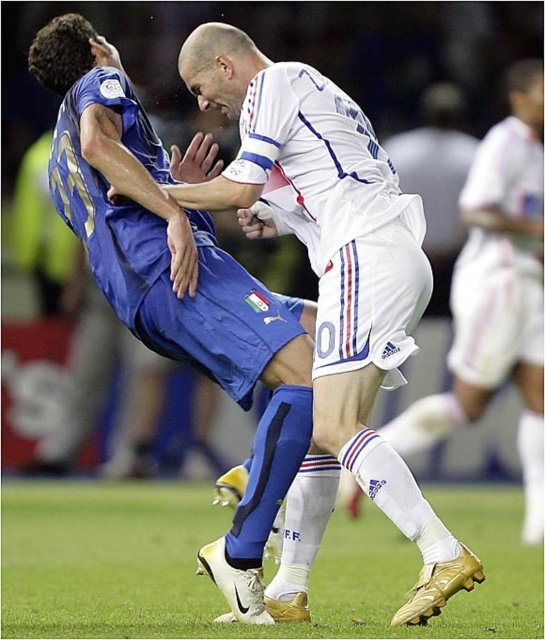
Based on the scene description, can you determine the position of the white smooth soccer player at center relative to the green grass at center?

The white smooth soccer player at center is positioned to the right of the green grass at center.

You are a soccer referee observing the match. You need to determine which of the two points, point (130,298) or point (483,358), is closer to you. Which one is it?

Point (130,298) is closer to the viewer than point (483,358).

You are a referee watching the soccer match. You see the white smooth soccer player at center and the green grass at center. Which object is closer to you?

The white smooth soccer player at center is closer to the viewer than the green grass at center.